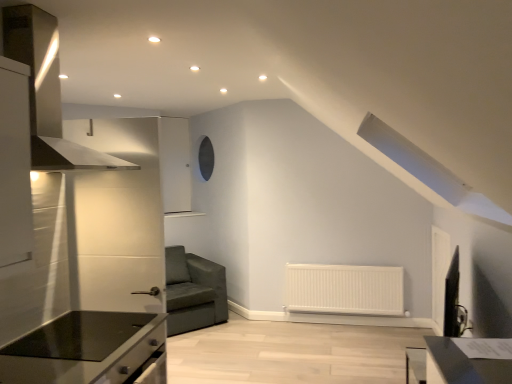
This screenshot has height=384, width=512. I want to click on free spot below white matte radiator at lower center (from a real-world perspective), so click(x=344, y=324).